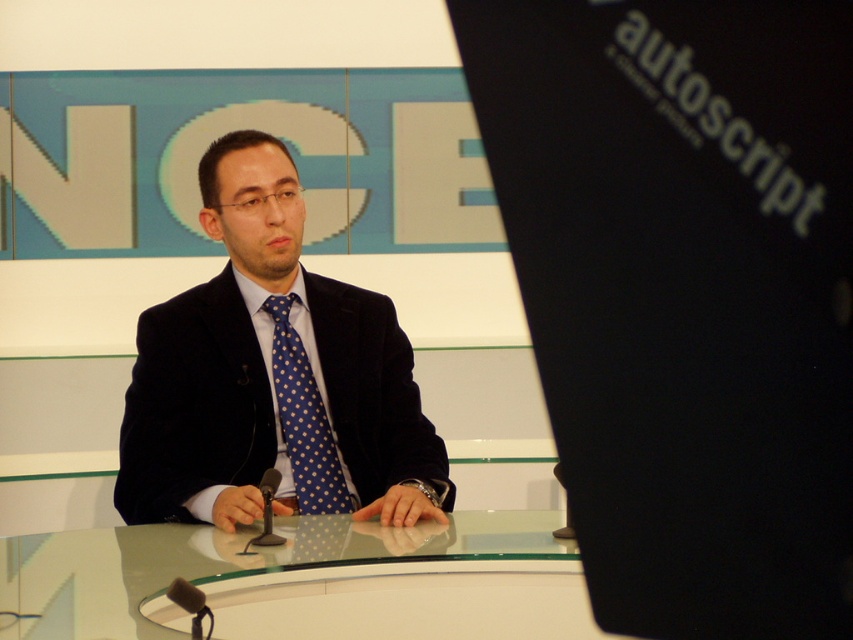
In order to click on satin black suit at center in this screenshot , I will do `click(271, 376)`.

Can you confirm if satin black suit at center is smaller than transparent glass table at center?

No, satin black suit at center is not smaller than transparent glass table at center.

Identify the location of satin black suit at center. This screenshot has width=853, height=640. (271, 376).

Who is positioned more to the left, transparent glass table at center or blue dotted fabric tie at center?

blue dotted fabric tie at center is more to the left.

Which is below, transparent glass table at center or blue dotted fabric tie at center?

transparent glass table at center is lower down.

Image resolution: width=853 pixels, height=640 pixels. I want to click on transparent glass table at center, so click(302, 580).

Where is `transparent glass table at center`? This screenshot has height=640, width=853. transparent glass table at center is located at coordinates (302, 580).

Can you confirm if satin black suit at center is thinner than blue dotted fabric tie at center?

Incorrect, satin black suit at center's width is not less than blue dotted fabric tie at center's.

Which is above, satin black suit at center or blue dotted fabric tie at center?

satin black suit at center is higher up.

Describe the element at coordinates (271, 376) in the screenshot. I see `satin black suit at center` at that location.

This screenshot has width=853, height=640. What are the coordinates of `satin black suit at center` in the screenshot? It's located at (271, 376).